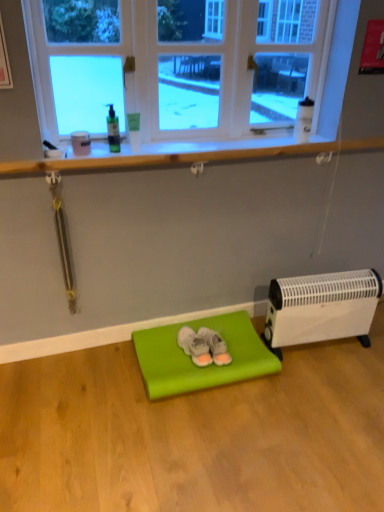
Locate an element on the screen. The image size is (384, 512). vacant space to the right of matte green yoga mat at center is located at coordinates (318, 395).